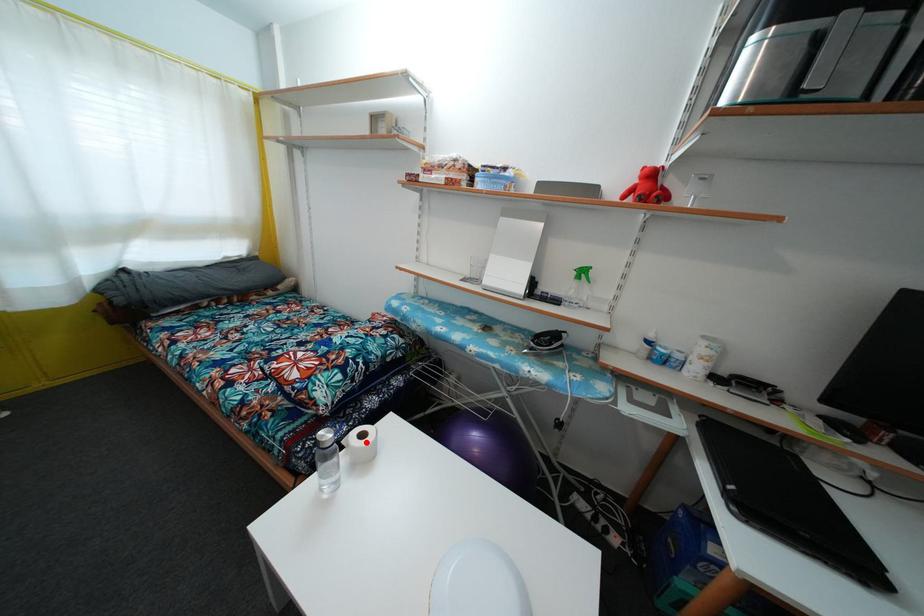
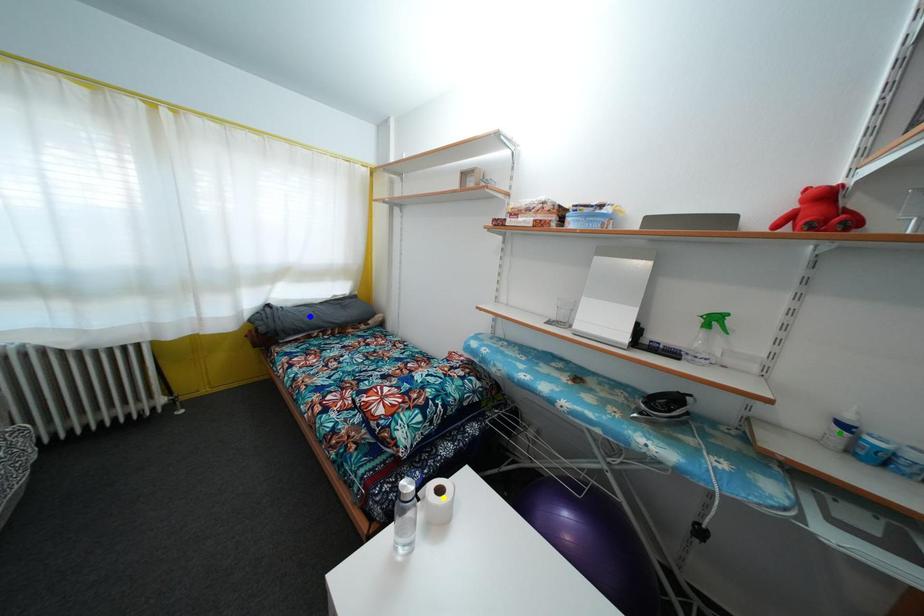
Question: I am providing you with two images of the same scene from different viewpoints. A red point is marked on the first image. You are given multiple points on the second image. Which point in image 2 represents the same 3d spot as the red point in image 1?

Choices:
 (A) yellow point
 (B) blue point
 (C) green point

Answer: (A)